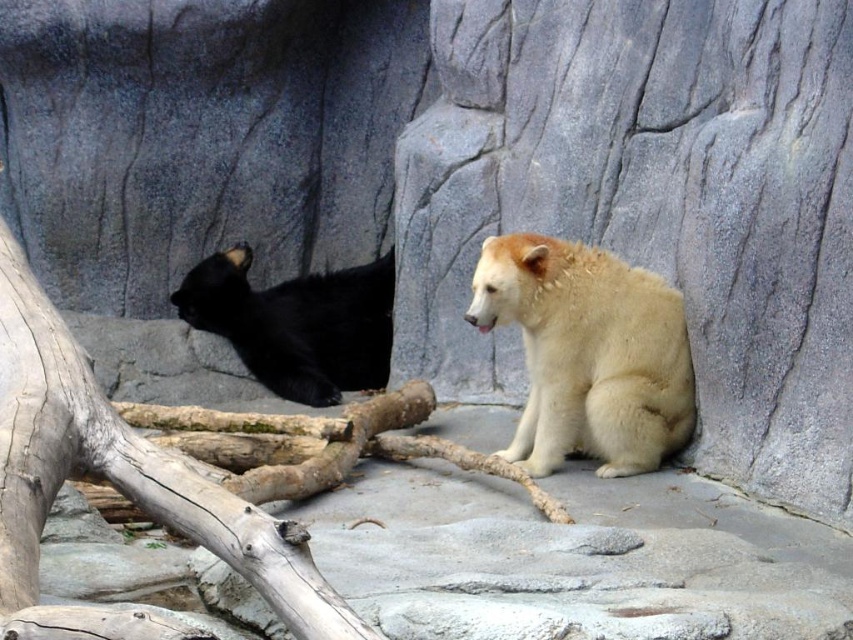
Question: Is smooth gray tree trunk at left above fuzzy white bear at center?

Choices:
 (A) yes
 (B) no

Answer: (B)

Question: Among these objects, which one is nearest to the camera?

Choices:
 (A) smooth gray tree trunk at left
 (B) fuzzy white bear at center

Answer: (A)

Question: Can you confirm if smooth gray tree trunk at left is thinner than fuzzy white bear at center?

Choices:
 (A) yes
 (B) no

Answer: (B)

Question: Estimate the real-world distances between objects in this image. Which object is farther from the black fur bear at left?

Choices:
 (A) smooth gray tree trunk at left
 (B) fuzzy white bear at center

Answer: (A)

Question: Is smooth gray tree trunk at left below black fur bear at left?

Choices:
 (A) yes
 (B) no

Answer: (A)

Question: Which of the following is the closest to the observer?

Choices:
 (A) smooth gray tree trunk at left
 (B) fuzzy white bear at center

Answer: (A)